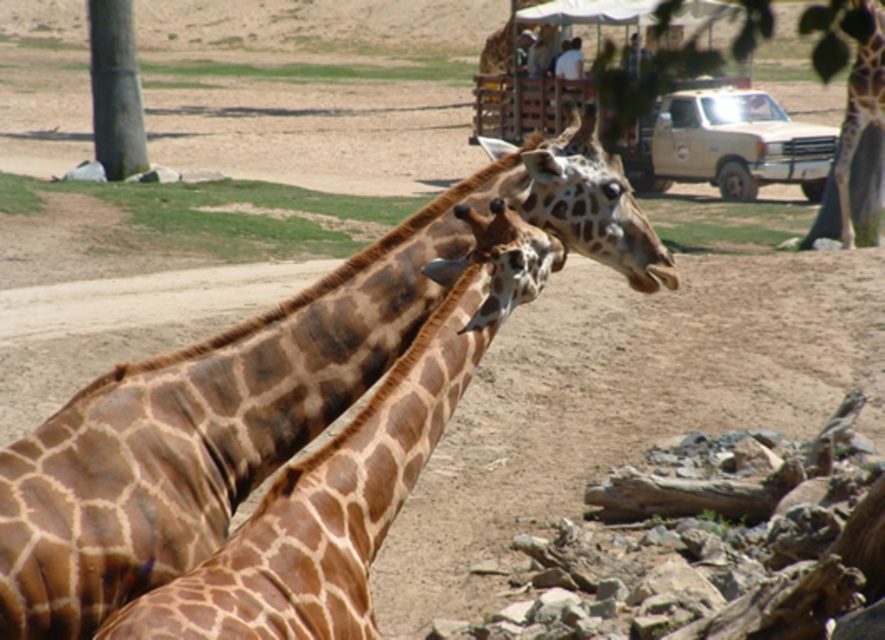
Question: Observing the image, what is the correct spatial positioning of brown spotted giraffe at center in reference to brown spotted giraffe at right?

Choices:
 (A) above
 (B) below

Answer: (B)

Question: Which object appears closest to the camera in this image?

Choices:
 (A) green bark tree at left
 (B) brown spotted giraffe at center
 (C) brown spotted giraffe at right

Answer: (B)

Question: Which of the following is the closest to the observer?

Choices:
 (A) camouflage fabric tent at upper center
 (B) brown spotted giraffe at right

Answer: (B)

Question: Can you confirm if green bark tree at left is wider than camouflage fabric tent at upper center?

Choices:
 (A) yes
 (B) no

Answer: (A)

Question: Can you confirm if brown spotted giraffe at center is positioned below beige matte truck at upper right?

Choices:
 (A) no
 (B) yes

Answer: (B)

Question: Which object is closer to the camera taking this photo?

Choices:
 (A) brown spotted giraffe at right
 (B) brown spotted giraffe at center
 (C) camouflage fabric tent at upper center

Answer: (B)